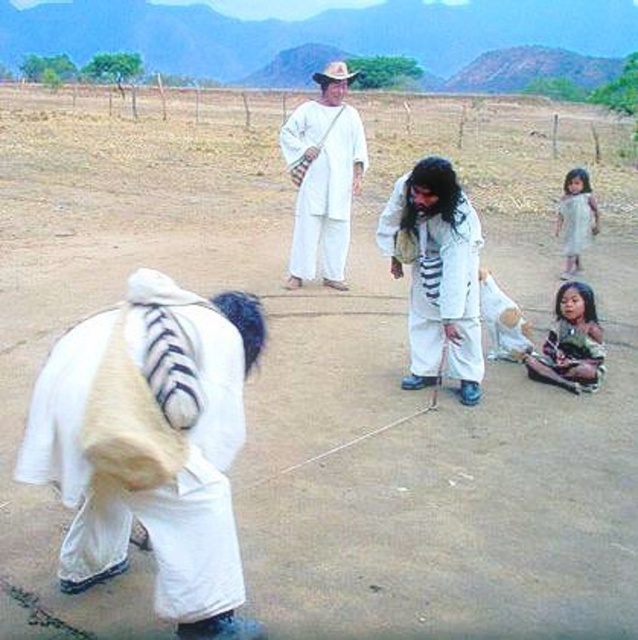
Question: Estimate the real-world distances between objects in this image. Which object is farther from the white cotton dress at lower right?

Choices:
 (A) white cotton shirt at center
 (B) white fur bag at center
 (C) white cotton robe at center
 (D) white cotton dress at right

Answer: (B)

Question: Is white cotton shirt at center to the left of white cotton robe at center from the viewer's perspective?

Choices:
 (A) yes
 (B) no

Answer: (A)

Question: Where is white cotton shirt at center located in relation to white cotton dress at right in the image?

Choices:
 (A) below
 (B) above

Answer: (B)

Question: Which point is farther to the camera?

Choices:
 (A) (582, 196)
 (B) (145, 269)
 (C) (302, 228)
 (D) (385, 230)

Answer: (A)

Question: Which is nearer to the white cotton dress at lower right?

Choices:
 (A) white fur bag at center
 (B) smooth skin child at lower right
 (C) white cotton dress at right
 (D) white cotton shirt at center

Answer: (C)

Question: Is white fur bag at center to the right of white cotton dress at lower right from the viewer's perspective?

Choices:
 (A) no
 (B) yes

Answer: (A)